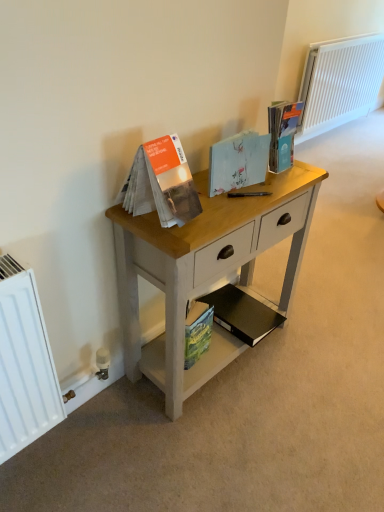
Where is `vacant area that is situated to the right of matte blue paperback book at upper right, the 4th paperback book when ordered from bottom to top`? vacant area that is situated to the right of matte blue paperback book at upper right, the 4th paperback book when ordered from bottom to top is located at coordinates (300, 170).